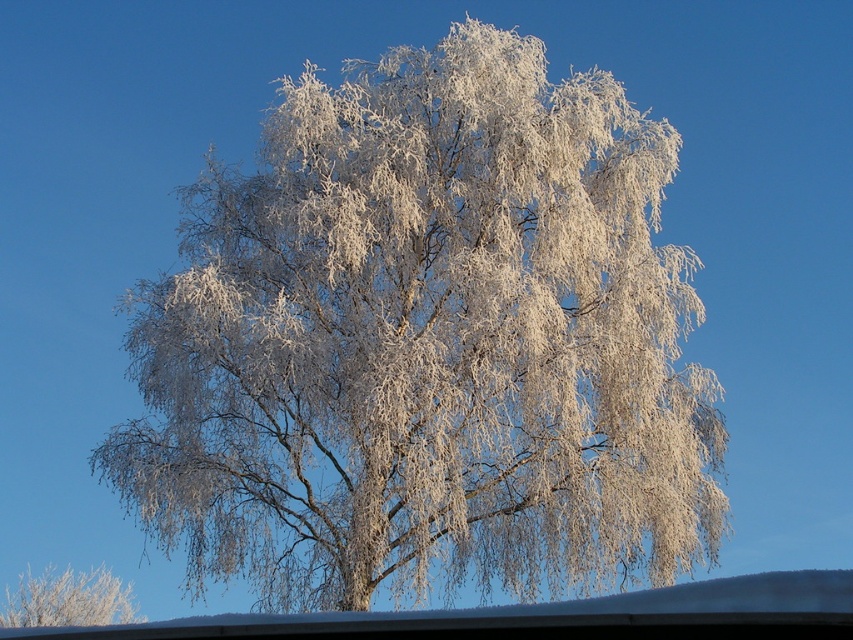
Question: Observing the image, what is the correct spatial positioning of white frosty birch tree at center in reference to frosted white branches at lower left?

Choices:
 (A) right
 (B) left

Answer: (A)

Question: Can you confirm if white frosty birch tree at center is wider than frosted white branches at lower left?

Choices:
 (A) yes
 (B) no

Answer: (A)

Question: Which of the following is the farthest from the observer?

Choices:
 (A) (650, 420)
 (B) (112, 595)

Answer: (B)

Question: Can you confirm if white frosty birch tree at center is positioned to the left of frosted white branches at lower left?

Choices:
 (A) yes
 (B) no

Answer: (B)

Question: Which object appears closest to the camera in this image?

Choices:
 (A) white frosty birch tree at center
 (B) frosted white branches at lower left

Answer: (A)